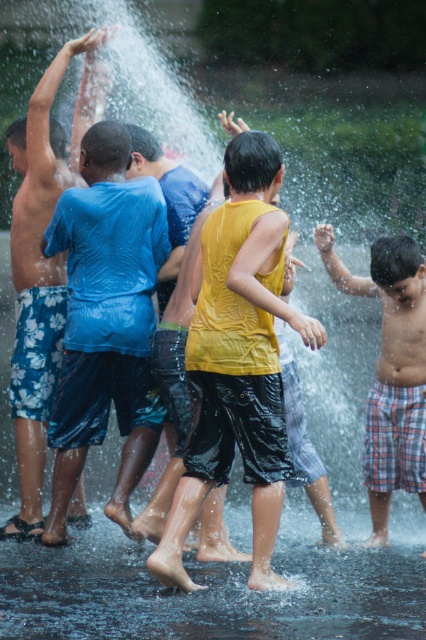
You are standing in the water park scene and want to walk from point A to point B. Point A is at coordinates point [36,376] and point B is at coordinates point [422,355]. Which point is closer to you when you start walking?

Point point [36,376] is closer to you than point point [422,355] because it is further to the viewer according to the description.

You are a photographer trying to capture a candid shot of the yellow shiny tank top at center and the blue floral shorts at left. Since you want to focus on both subjects, which one should you position closer to the camera to ensure both are in focus without moving the camera?

The yellow shiny tank top at center is positioned under the blue floral shorts at left. To ensure both are in focus, you should position the blue floral shorts at left closer to the camera since it is above the yellow shiny tank top at center, allowing the depth of field to cover both when focusing on the closer subject.

You are standing at the water park and want to reach a specific location marked by the point at coordinates (169, 552). If you can walk 2 meters per second, how long will it take you to reach that point?

The point at coordinates (169, 552) is 16.28 meters away from you. At a walking speed of 2 meters per second, it will take approximately 8.14 seconds to reach the point.